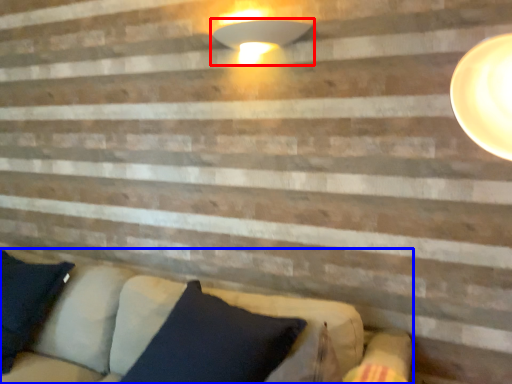
Question: Which of the following is the farthest to the observer, lamp (highlighted by a red box) or studio couch (highlighted by a blue box)?

Choices:
 (A) lamp
 (B) studio couch

Answer: (A)